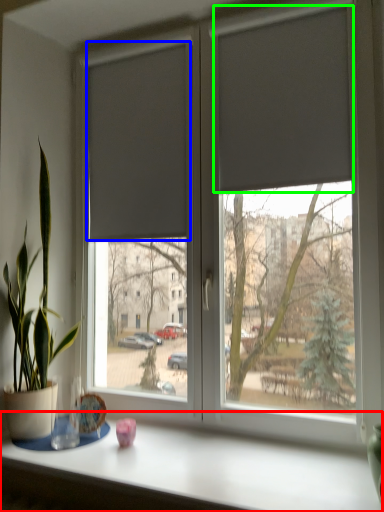
Question: Which object is the farthest from table (highlighted by a red box)? Choose among these: curtain (highlighted by a blue box) or curtain (highlighted by a green box).

Choices:
 (A) curtain
 (B) curtain

Answer: (B)